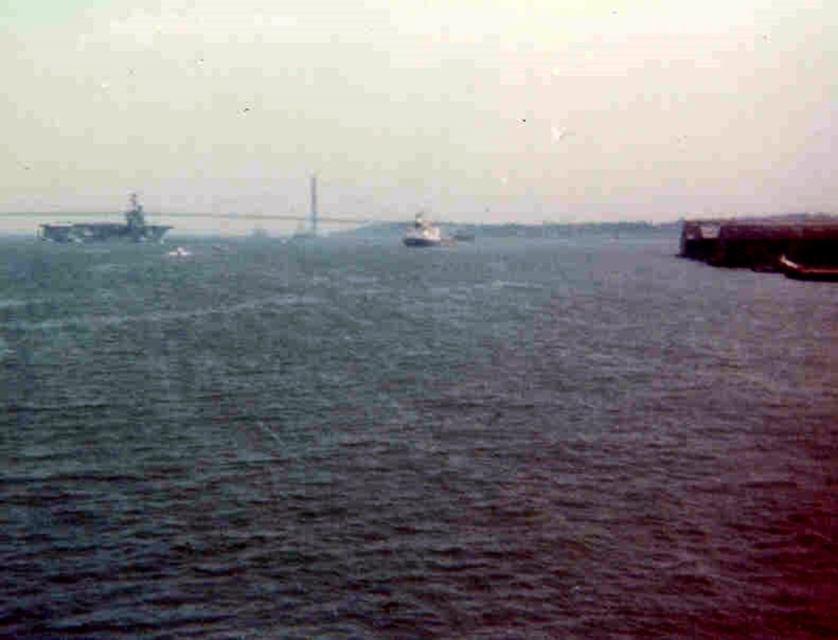
You are a drone operator controlling a drone that needs to fly from the metallic gray ship at left to the destination point at coordinate 0.5, 0.5. The drone has a limited battery that can only travel 0.2 units. Can the drone reach the destination?

The metallic gray ship at left is located at coordinate (106, 228). The distance between this point and the destination point (419, 320) is sqrt of squared differences, which is sqrt of 0.142 squared plus 0.372 squared. Calculating that gives approximately sqrt of 0.020164 plus 0.138384 equals sqrt of 0.158548, which is approximately 0.398 units. Since the drone can only travel 0.2 units, it cannot reach the destination.

You are standing on the deck of the naval vessel and want to determine the distance between two points marked on your map. The first point is labeled as point (106, 225) and the second is point (407, 243). Given that the naval vessel is your current position, which point is closer to you?

Point (106, 225) is closer to the naval vessel because it is further to the viewer than point (407, 243).

You are a marine biologist observing the harbor. You need to determine which object occupies more area in the image between the dark blue water at center and the metallic gray ship at left. Based on the scene, which one is larger?

The dark blue water at center is larger in size than the metallic gray ship at left, so the dark blue water at center occupies more area in the image.